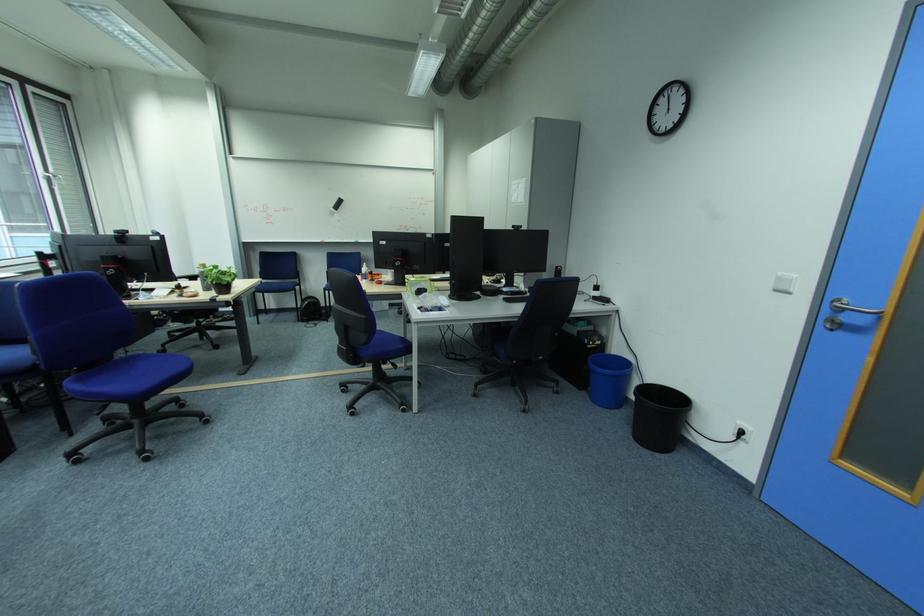
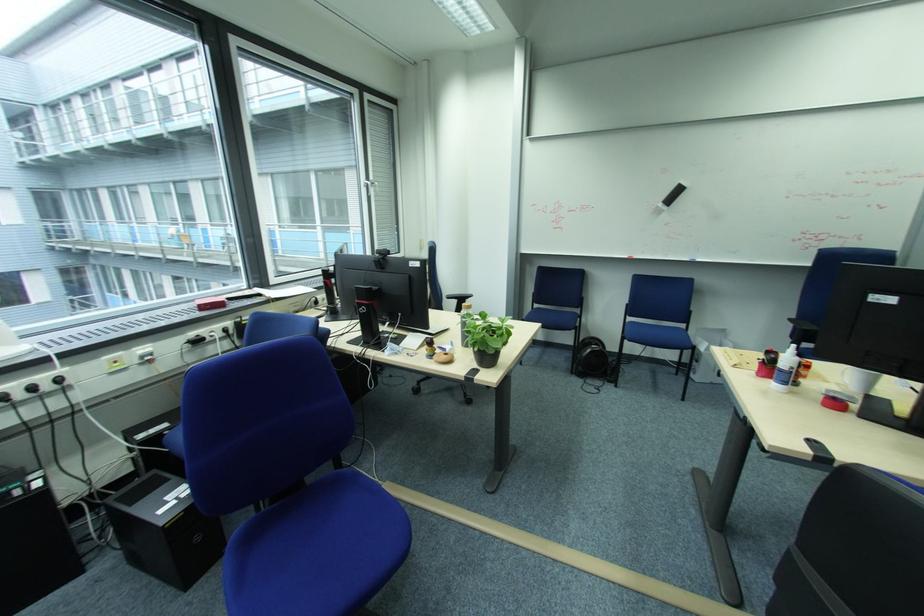
The point at [334,291] is marked in the first image. Where is the corresponding point in the second image?

(633, 339)